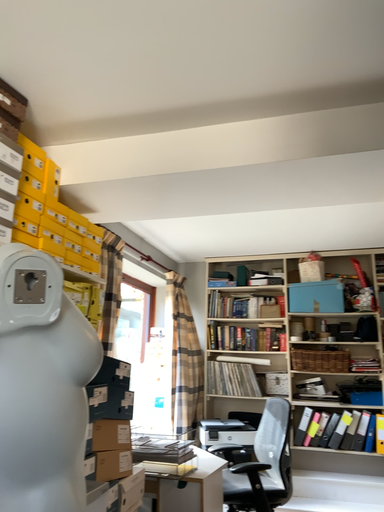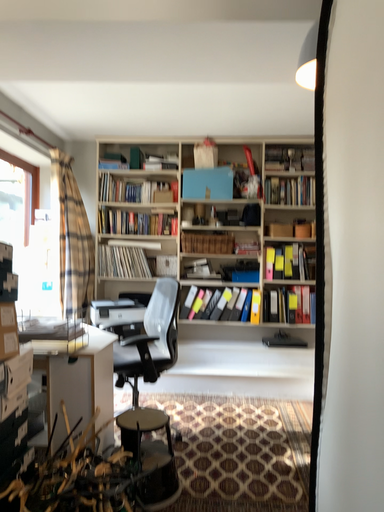
Question: How did the camera likely rotate when shooting the video?

Choices:
 (A) rotated left
 (B) rotated right

Answer: (B)